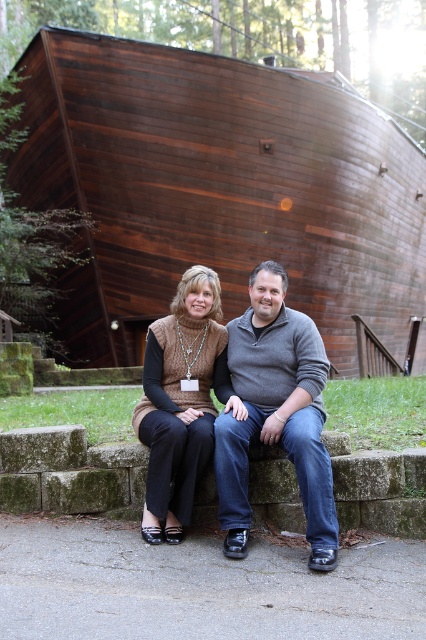
Does point (180, 241) come farther from viewer compared to point (180, 496)?

Yes, it is.

Which of these two, dark wood boat at center or knit sweater at center, stands taller?

Standing taller between the two is dark wood boat at center.

Which is in front, point (291, 234) or point (158, 362)?

Point (158, 362) is in front.

Where is `dark wood boat at center`? The width and height of the screenshot is (426, 640). dark wood boat at center is located at coordinates click(218, 188).

Is gray sweater at center above knit sweater at center?

Actually, gray sweater at center is below knit sweater at center.

Is gray sweater at center closer to the viewer compared to knit sweater at center?

Yes, it is.

Does point (270, 436) lie in front of point (166, 362)?

Yes, point (270, 436) is closer to viewer.

Identify the location of gray sweater at center. Image resolution: width=426 pixels, height=640 pixels. (x=276, y=413).

Does dark wood boat at center lie behind gray sweater at center?

Yes, it is.

Is dark wood boat at center smaller than gray sweater at center?

No, dark wood boat at center is not smaller than gray sweater at center.

Looking at this image, who is more forward, (129,195) or (253,323)?

Positioned in front is point (253,323).

Image resolution: width=426 pixels, height=640 pixels. Identify the location of dark wood boat at center. (x=218, y=188).